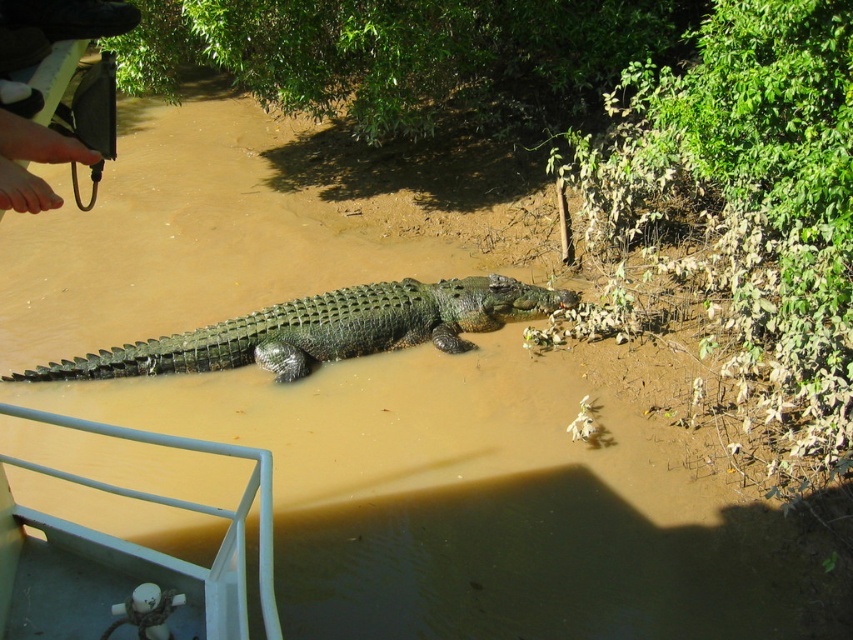
Question: Which point is closer to the camera taking this photo?

Choices:
 (A) (26, 131)
 (B) (303, 308)

Answer: (A)

Question: Can you confirm if green scaly crocodile at center is positioned to the right of brown leather shoe at upper left?

Choices:
 (A) no
 (B) yes

Answer: (B)

Question: Does green scaly crocodile at center come in front of brown leather shoe at upper left?

Choices:
 (A) no
 (B) yes

Answer: (A)

Question: In this image, where is green scaly crocodile at center located relative to brown leather shoe at upper left?

Choices:
 (A) below
 (B) above

Answer: (A)